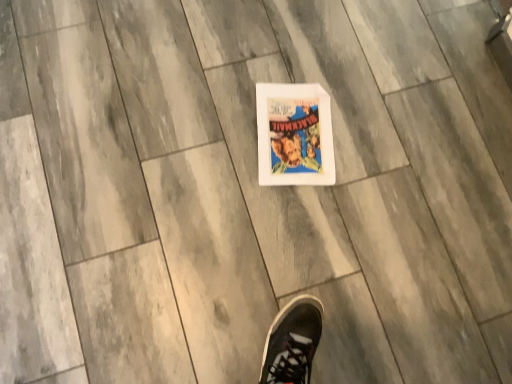
Identify the location of free space to the left of matte paper comic book at center. The width and height of the screenshot is (512, 384). (220, 107).